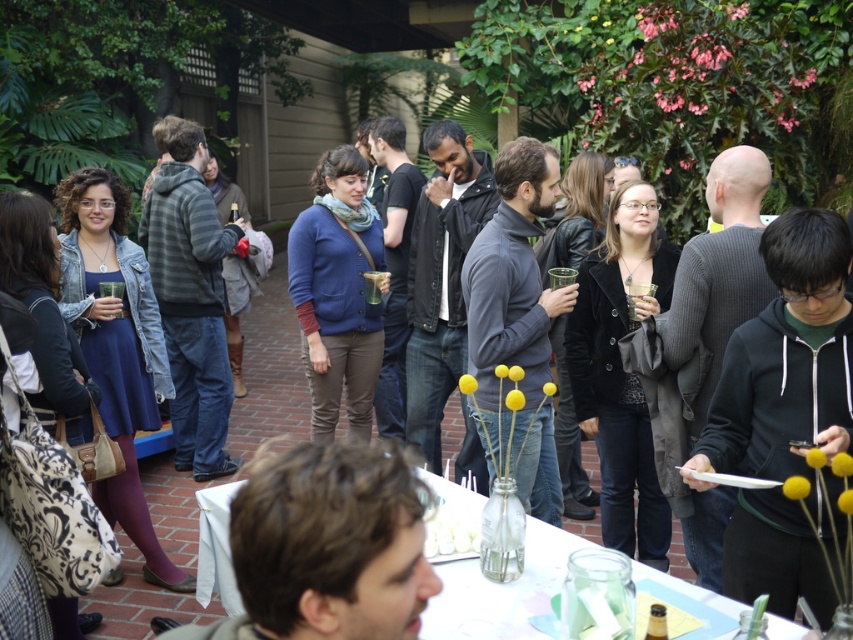
In the scene shown: You are at a garden party and want to place a napkin on the white paper plate at center. Where exactly should you place it?

The white paper plate at center is located at coordinates point (500, 589), so you should place the napkin precisely at that position.

You are at a garden party and see a white paper plate at center and a white frosted cake at center. Which object is taller?

The white paper plate at center is taller than the white frosted cake at center.